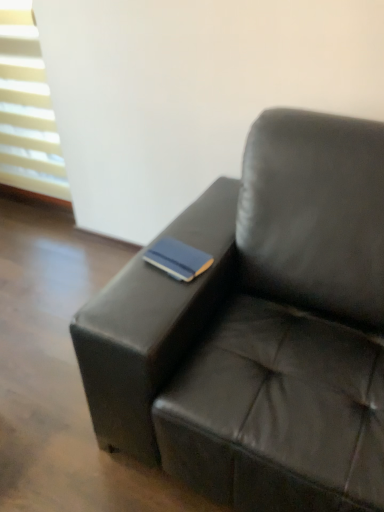
Question: From a real-world perspective, is black leather couch at center beneath blue matte book at center?

Choices:
 (A) no
 (B) yes

Answer: (B)

Question: Is black leather couch at center at the right side of blue matte book at center?

Choices:
 (A) yes
 (B) no

Answer: (A)

Question: Considering the relative positions of black leather couch at center and blue matte book at center in the image provided, is black leather couch at center to the left of blue matte book at center from the viewer's perspective?

Choices:
 (A) yes
 (B) no

Answer: (B)

Question: Is black leather couch at center not inside blue matte book at center?

Choices:
 (A) no
 (B) yes

Answer: (B)

Question: Is black leather couch at center oriented towards blue matte book at center?

Choices:
 (A) yes
 (B) no

Answer: (A)

Question: Would you say black leather couch at center is inside or outside white plastic blinds at upper left?

Choices:
 (A) inside
 (B) outside

Answer: (B)

Question: Is black leather couch at center taller or shorter than white plastic blinds at upper left?

Choices:
 (A) tall
 (B) short

Answer: (B)

Question: From a real-world perspective, relative to white plastic blinds at upper left, is black leather couch at center vertically above or below?

Choices:
 (A) above
 (B) below

Answer: (B)

Question: Is point (258, 173) positioned closer to the camera than point (0, 106)?

Choices:
 (A) farther
 (B) closer

Answer: (B)

Question: Relative to blue matte book at center, is black leather couch at center in front or behind?

Choices:
 (A) behind
 (B) front

Answer: (B)

Question: From a real-world perspective, is black leather couch at center physically located above or below blue matte book at center?

Choices:
 (A) above
 (B) below

Answer: (B)

Question: Is black leather couch at center wider or thinner than blue matte book at center?

Choices:
 (A) wide
 (B) thin

Answer: (A)

Question: Visually, is black leather couch at center positioned to the left or to the right of blue matte book at center?

Choices:
 (A) left
 (B) right

Answer: (B)

Question: From a real-world perspective, is blue matte book at center physically located above or below white plastic blinds at upper left?

Choices:
 (A) above
 (B) below

Answer: (B)

Question: Does point (192, 278) appear closer or farther from the camera than point (13, 62)?

Choices:
 (A) closer
 (B) farther

Answer: (A)